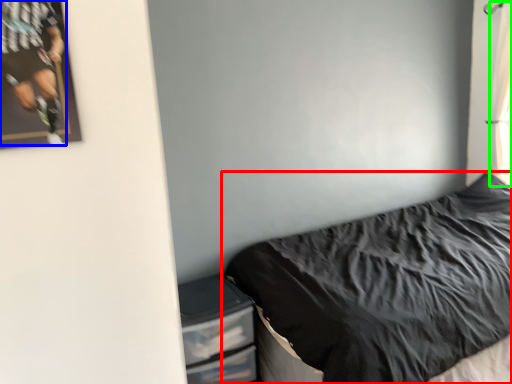
Question: Estimate the real-world distances between objects in this image. Which object is closer to bed (highlighted by a red box), person (highlighted by a blue box) or curtain (highlighted by a green box)?

Choices:
 (A) person
 (B) curtain

Answer: (B)